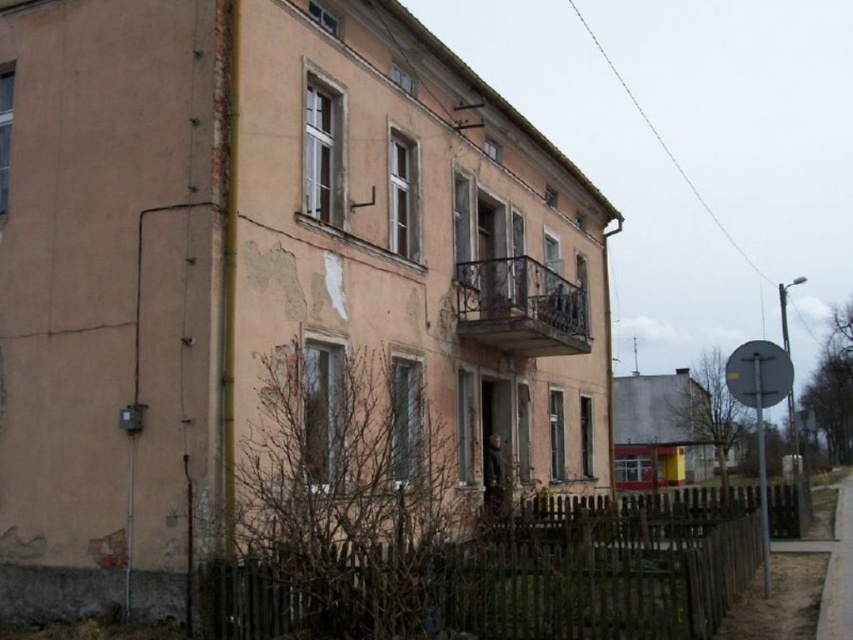
In the scene shown: You are a delivery person trying to enter the yard through the gap between the brown wooden fence at lower center and the silver metallic sign at right. Can you pass through the gap if your delivery cart is 1 meter wide?

The brown wooden fence at lower center is thinner than the silver metallic sign at right. However, the description does not provide the exact width of the gap between them. Without knowing the actual width of the gap, it is impossible to determine if the delivery cart can pass through.